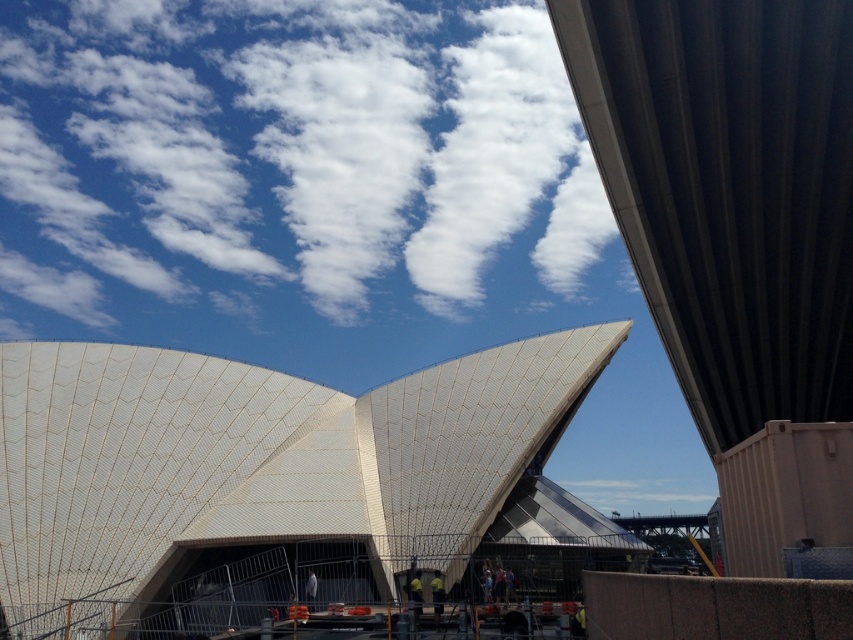
Does point (521, 54) come farther from viewer compared to point (53, 403)?

Yes, point (521, 54) is behind point (53, 403).

Is white fluffy cloud at upper center bigger than white textured roof at center?

Yes, white fluffy cloud at upper center is bigger than white textured roof at center.

Which is in front, point (22, 100) or point (221, 609)?

Point (221, 609) is in front.

Identify the location of white fluffy cloud at upper center. The width and height of the screenshot is (853, 640). [289, 156].

Can you confirm if white fluffy cloud at upper center is positioned to the left of yellow fabric construction worker at center?

Indeed, white fluffy cloud at upper center is positioned on the left side of yellow fabric construction worker at center.

Does white fluffy cloud at upper center lie behind yellow fabric construction worker at center?

Yes.

Which is in front, point (90, 8) or point (437, 604)?

Positioned in front is point (437, 604).

The image size is (853, 640). I want to click on white fluffy cloud at upper center, so click(289, 156).

From the picture: How distant is white textured roof at center from yellow fabric construction worker at lower center?

white textured roof at center is 24.43 meters from yellow fabric construction worker at lower center.

Who is positioned more to the left, white textured roof at center or yellow fabric construction worker at lower center?

From the viewer's perspective, white textured roof at center appears more on the left side.

Which is in front, point (41, 577) or point (409, 589)?

Positioned in front is point (409, 589).

Identify the location of white textured roof at center. (271, 481).